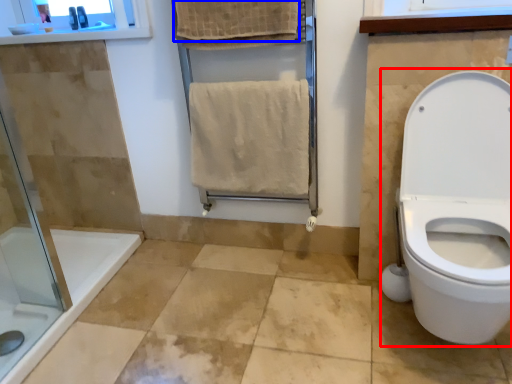
Question: Among these objects, which one is farthest to the camera, sit (highlighted by a red box) or bath towel (highlighted by a blue box)?

Choices:
 (A) sit
 (B) bath towel

Answer: (B)